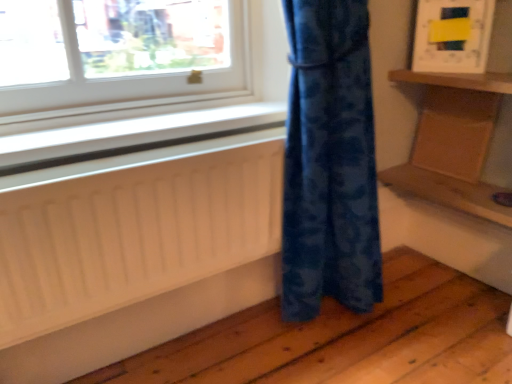
Measure the distance between white plastic window sill at lower left and camera.

The distance of white plastic window sill at lower left from camera is 37.93 inches.

What is the approximate width of wooden shelf at upper right, acting as the first shelf starting from the top?

The width of wooden shelf at upper right, acting as the first shelf starting from the top, is 9.85 inches.

The height and width of the screenshot is (384, 512). Identify the location of wooden at right, the second shelf in the top-to-bottom sequence. (448, 192).

What do you see at coordinates (133, 235) in the screenshot?
I see `white matte radiator at lower left` at bounding box center [133, 235].

At what (x,y) coordinates should I click in order to perform the action: click on white plastic window sill at lower left. Please return your answer as a coordinate pair (x, y). This screenshot has width=512, height=384. Looking at the image, I should click on (132, 135).

Is white plastic window sill at lower left to the left of white matte radiator at lower left from the viewer's perspective?

Yes, white plastic window sill at lower left is to the left of white matte radiator at lower left.

From a real-world perspective, is white plastic window sill at lower left on white matte radiator at lower left?

Indeed, from a real-world perspective, white plastic window sill at lower left stands above white matte radiator at lower left.

The width and height of the screenshot is (512, 384). In order to click on window sill on the left side of white matte radiator at lower left in this screenshot , I will do `click(132, 135)`.

How distant is white plastic window sill at lower left from white matte radiator at lower left?

white plastic window sill at lower left is 7.67 inches away from white matte radiator at lower left.

Between wooden tray at right and white matte radiator at lower left, which one has less height?

With less height is wooden tray at right.

Considering the points (460, 96) and (154, 282), which point is in front, point (460, 96) or point (154, 282)?

The point (154, 282) is closer to the camera.

Are wooden tray at right and white matte radiator at lower left far apart?

No, wooden tray at right is not far from white matte radiator at lower left.

Is wooden tray at right wider than white matte radiator at lower left?

In fact, wooden tray at right might be narrower than white matte radiator at lower left.

Which of these two, wooden tray at right or wooden at right, the second shelf in the top-to-bottom sequence, stands shorter?

With less height is wooden at right, the second shelf in the top-to-bottom sequence.

Is wooden tray at right located outside wooden at right, the second shelf in the top-to-bottom sequence?

wooden tray at right lies outside wooden at right, the second shelf in the top-to-bottom sequence,'s area.

Does point (450, 109) come in front of point (481, 195)?

No, (450, 109) is further to viewer.

Is point (264, 118) in front of point (489, 205)?

Yes, point (264, 118) is in front of point (489, 205).

What's the angular difference between white plastic window sill at lower left and wooden at right, the first shelf when ordered from bottom to top,'s facing directions?

The angular difference between white plastic window sill at lower left and wooden at right, the first shelf when ordered from bottom to top, is 87.7 degrees.

From a real-world perspective, which object rests below the other?

wooden at right, the second shelf in the top-to-bottom sequence, from a real-world perspective.

Could wooden at right, the first shelf when ordered from bottom to top, be considered to be inside white plastic window sill at lower left?

No, wooden at right, the first shelf when ordered from bottom to top, is located outside of white plastic window sill at lower left.

Is point (400, 165) farther from viewer compared to point (234, 253)?

That is True.

Is wooden at right, the second shelf in the top-to-bottom sequence, closer to camera compared to white matte radiator at lower left?

No.

Is wooden at right, the second shelf in the top-to-bottom sequence, positioned with its back to white matte radiator at lower left?

No, white matte radiator at lower left is not at the back of wooden at right, the second shelf in the top-to-bottom sequence.

Would you say wooden at right, the first shelf when ordered from bottom to top, contains white matte radiator at lower left?

No.

Is white plastic window sill at lower left facing towards wooden shelf at upper right, the second shelf from the bottom?

No, white plastic window sill at lower left is not facing towards wooden shelf at upper right, the second shelf from the bottom.

Is white plastic window sill at lower left positioned beyond the bounds of wooden shelf at upper right, acting as the first shelf starting from the top?

white plastic window sill at lower left lies outside wooden shelf at upper right, acting as the first shelf starting from the top,'s area.

Is white plastic window sill at lower left in contact with wooden shelf at upper right, the second shelf from the bottom?

No, white plastic window sill at lower left is not in contact with wooden shelf at upper right, the second shelf from the bottom.

Which of these two, white matte radiator at lower left or wooden shelf at upper right, the second shelf from the bottom, stands shorter?

With less height is wooden shelf at upper right, the second shelf from the bottom.

Where is `radiator below the wooden shelf at upper right, acting as the first shelf starting from the top (from the image's perspective)`? Image resolution: width=512 pixels, height=384 pixels. radiator below the wooden shelf at upper right, acting as the first shelf starting from the top (from the image's perspective) is located at coordinates (133, 235).

Which point is more forward, (x=169, y=217) or (x=400, y=73)?

Point (x=169, y=217)

Is white matte radiator at lower left looking in the opposite direction of wooden shelf at upper right, the second shelf from the bottom?

No, white matte radiator at lower left is not facing away from wooden shelf at upper right, the second shelf from the bottom.

Where is `window sill positioned vertically above the white matte radiator at lower left (from a real-world perspective)`? Image resolution: width=512 pixels, height=384 pixels. window sill positioned vertically above the white matte radiator at lower left (from a real-world perspective) is located at coordinates (132, 135).

Locate an element on the screen. The height and width of the screenshot is (384, 512). furniture on the right of the white matte radiator at lower left is located at coordinates click(454, 143).

Which object lies nearer to the anchor point white matte radiator at lower left, wooden at right, the first shelf when ordered from bottom to top, or wooden tray at right?

wooden tray at right is closer to white matte radiator at lower left.

Looking at the image, which one is located closer to wooden tray at right, white matte radiator at lower left or wooden at right, the second shelf in the top-to-bottom sequence?

Based on the image, wooden at right, the second shelf in the top-to-bottom sequence, appears to be nearer to wooden tray at right.

When comparing their distances from wooden at right, the second shelf in the top-to-bottom sequence, does wooden shelf at upper right, the second shelf from the bottom, or wooden tray at right seem further?

wooden shelf at upper right, the second shelf from the bottom, is positioned further to the anchor wooden at right, the second shelf in the top-to-bottom sequence.

Looking at the image, which one is located further to wooden tray at right, wooden shelf at upper right, acting as the first shelf starting from the top, or white matte radiator at lower left?

white matte radiator at lower left is positioned further to the anchor wooden tray at right.

Estimate the real-world distances between objects in this image. Which object is closer to white matte radiator at lower left, wooden tray at right or wooden at right, the second shelf in the top-to-bottom sequence?

wooden tray at right.

Considering their positions, is white plastic window sill at lower left positioned closer to wooden shelf at upper right, the second shelf from the bottom, than wooden tray at right?

wooden tray at right is closer to wooden shelf at upper right, the second shelf from the bottom.

Considering their positions, is wooden shelf at upper right, the second shelf from the bottom, positioned closer to wooden tray at right than white plastic window sill at lower left?

Among the two, wooden shelf at upper right, the second shelf from the bottom, is located nearer to wooden tray at right.

Looking at the image, which one is located further to wooden at right, the first shelf when ordered from bottom to top, wooden tray at right or white plastic window sill at lower left?

white plastic window sill at lower left lies further to wooden at right, the first shelf when ordered from bottom to top, than the other object.

Locate an element on the screen. The width and height of the screenshot is (512, 384). furniture between wooden shelf at upper right, acting as the first shelf starting from the top, and wooden at right, the first shelf when ordered from bottom to top, in the vertical direction is located at coordinates (454, 143).

Image resolution: width=512 pixels, height=384 pixels. In order to click on radiator situated between white plastic window sill at lower left and wooden shelf at upper right, acting as the first shelf starting from the top, from left to right in this screenshot , I will do `click(133, 235)`.

The height and width of the screenshot is (384, 512). I want to click on shelf between white matte radiator at lower left and wooden at right, the second shelf in the top-to-bottom sequence, in the horizontal direction, so click(457, 80).

Identify the location of radiator located between white plastic window sill at lower left and wooden tray at right in the left-right direction. This screenshot has width=512, height=384. (133, 235).